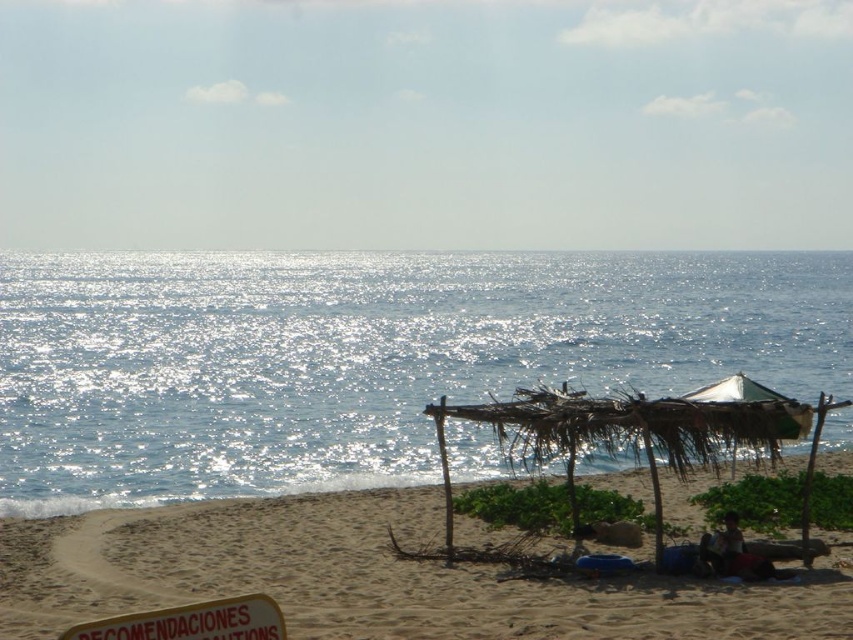
Question: Which point appears closest to the camera in this image?

Choices:
 (A) (540, 442)
 (B) (204, 618)
 (C) (538, 326)

Answer: (B)

Question: Is sandy beach at lower center closer to the viewer compared to brown leather bag at lower right?

Choices:
 (A) no
 (B) yes

Answer: (B)

Question: Is green thatched umbrella at center smaller than white plastic sign at lower left?

Choices:
 (A) no
 (B) yes

Answer: (A)

Question: Which object appears farthest from the camera in this image?

Choices:
 (A) green thatched umbrella at center
 (B) white plastic sign at lower left
 (C) brown leather bag at lower right
 (D) sandy beach at lower center

Answer: (A)

Question: In this image, where is sandy beach at lower center located relative to white plastic sign at lower left?

Choices:
 (A) above
 (B) below

Answer: (B)

Question: Which point is farther to the camera?

Choices:
 (A) (833, 310)
 (B) (184, 506)

Answer: (A)